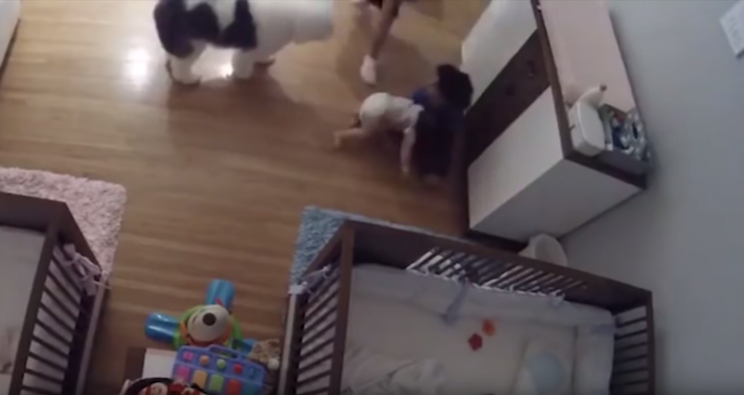
Locate an element on the screen. toys is located at coordinates (193, 351), (170, 324).